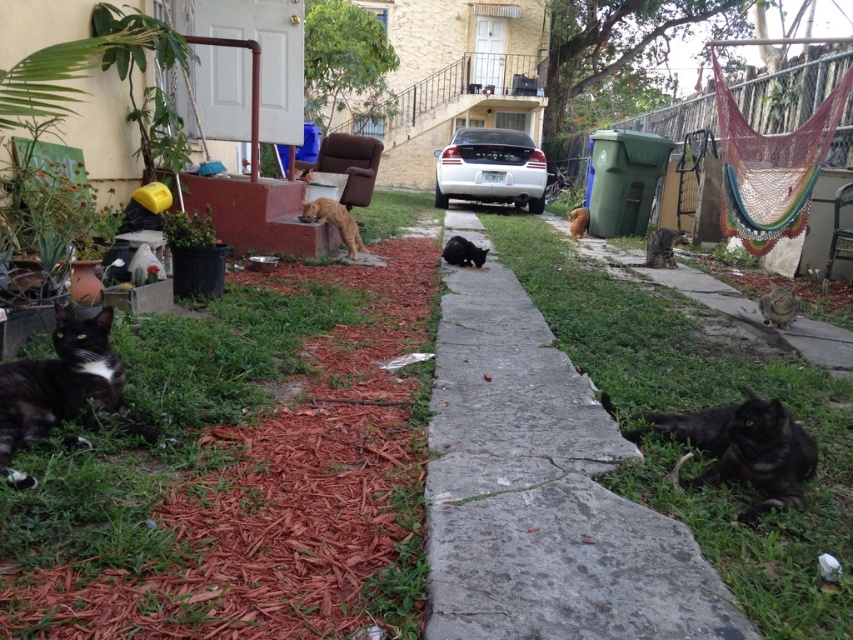
Can you confirm if black fur cat at lower right is shorter than tabby fur cat at lower right?

No.

Is point (764, 509) positioned before point (780, 300)?

Yes, point (764, 509) is in front of point (780, 300).

Locate an element on the screen. The height and width of the screenshot is (640, 853). black fur cat at lower right is located at coordinates (744, 449).

Can you confirm if green grass at left is smaller than fuzzy brown cat at center?

Yes.

The width and height of the screenshot is (853, 640). I want to click on green grass at left, so click(241, 470).

Is point (207, 376) closer to camera compared to point (358, 241)?

Yes, it is in front of point (358, 241).

Locate an element on the screen. green grass at left is located at coordinates (241, 470).

Is point (515, 144) positioned before point (344, 240)?

No, it is behind (344, 240).

Does point (437, 184) lie in front of point (341, 220)?

No, it is not.

Where is `silver metallic car at center`? Image resolution: width=853 pixels, height=640 pixels. silver metallic car at center is located at coordinates (490, 168).